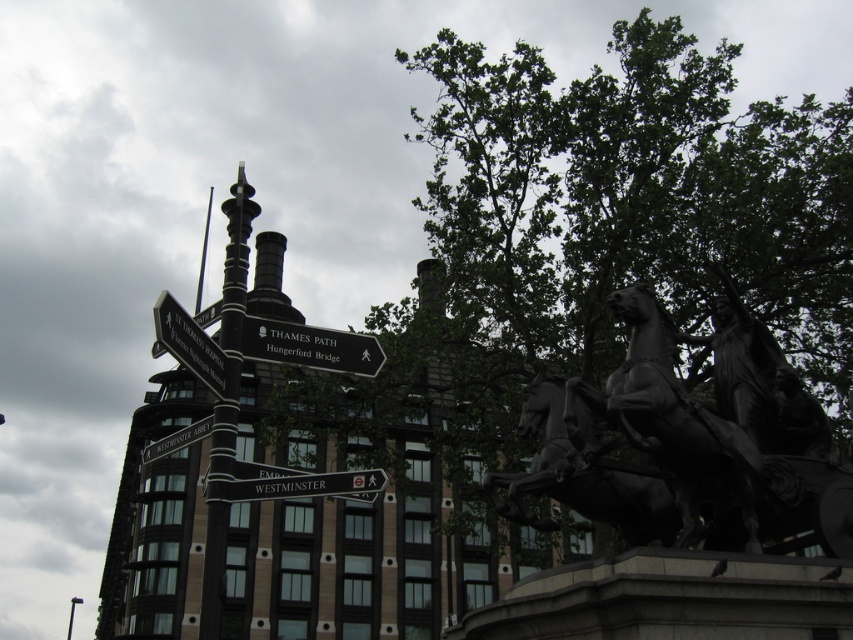
Measure the distance between black plastic sign at center and black metal sign at upper left.

black plastic sign at center and black metal sign at upper left are 4.69 meters apart.

Is black plastic sign at center wider than black metal sign at upper left?

No, black plastic sign at center is not wider than black metal sign at upper left.

Which is behind, point (291, 481) or point (177, 429)?

The point (177, 429) is behind.

Locate an element on the screen. This screenshot has height=640, width=853. black plastic sign at center is located at coordinates point(291,483).

Measure the distance between black polished metal pole at center and camera.

The distance of black polished metal pole at center from camera is 93.14 feet.

Based on the photo, between black polished metal pole at center and black metal sign at upper left, which one is positioned lower?

black metal sign at upper left

Who is more forward, (225, 449) or (177, 442)?

Point (225, 449) is in front.

Find the location of `black polished metal pole at center`. black polished metal pole at center is located at coordinates (225, 404).

Between point (660, 348) and point (326, 346), which one is positioned in front?

Point (660, 348)

Does polished bronze horse at center have a greater width compared to black plastic sign at upper center?

In fact, polished bronze horse at center might be narrower than black plastic sign at upper center.

What do you see at coordinates (677, 420) in the screenshot? The image size is (853, 640). I see `polished bronze horse at center` at bounding box center [677, 420].

At what (x,y) coordinates should I click in order to perform the action: click on polished bronze horse at center. Please return your answer as a coordinate pair (x, y). This screenshot has width=853, height=640. Looking at the image, I should click on point(677,420).